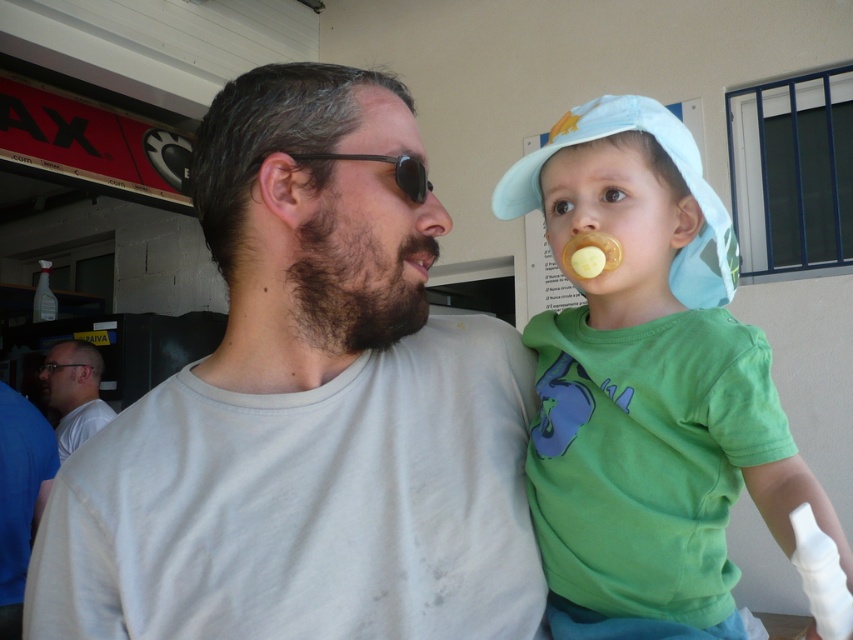
You are taking a photo of two points in the image. The first point is labeled as point (239,531) and the second is point (90,362). Which point will appear larger in your photo?

Point (239,531) is closer to the camera than point (90,362), so it will appear larger in the photo.

You are a photographer trying to capture a candid shot of the scene. You notice the light blue fabric baseball cap at upper right and the white matte shirt at left. Which object should you focus on to ensure the subject in the foreground is properly highlighted?

The light blue fabric baseball cap at upper right is above the white matte shirt at left, so focusing on the light blue fabric baseball cap at upper right would ensure the foreground subject is highlighted as it is positioned higher in the frame.